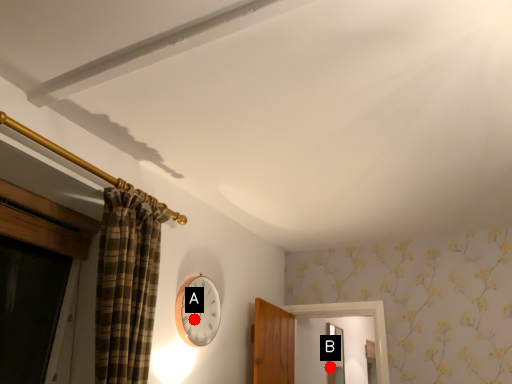
Question: Two points are circled on the image, labeled by A and B beside each circle. Which of the following is the closest to the observer?

Choices:
 (A) A is closer
 (B) B is closer

Answer: (A)